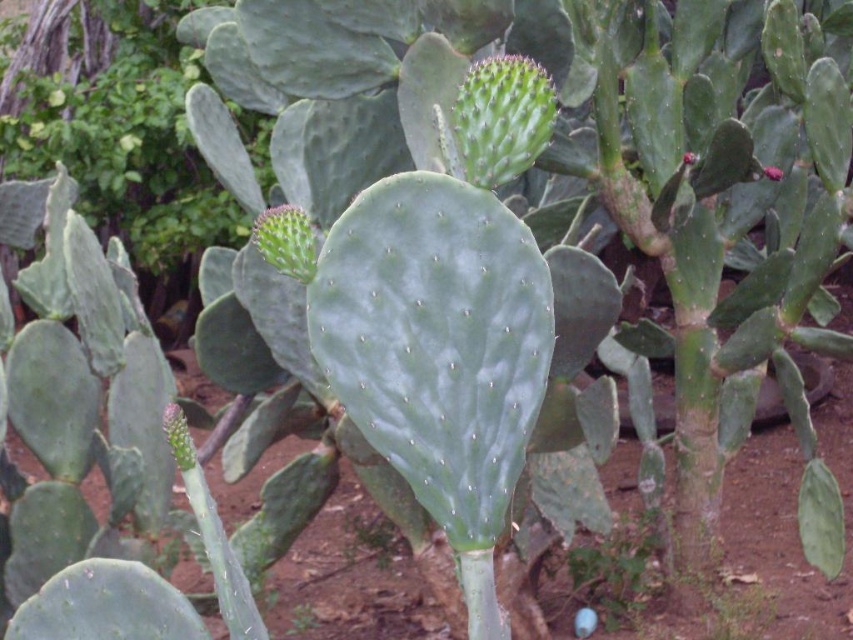
You are a botanist examining two flowers on a prickly pear cactus. You notice a matte pink flower at center and a smooth red flower at upper right. Which flower is larger?

The matte pink flower at center is bigger than the smooth red flower at upper right.

You are a botanist examining a prickly pear cactus. You notice a point labeled as point [772,172]. What is the significance of this point?

The point [772,172] corresponds to the location of the matte pink flower at center.

You are a botanist measuring the distance between two flowers on a cactus. You have a ruler that can extend up to 10 inches. Can you measure the distance between the matte pink flower at center and the smooth red flower at upper right without the ruler extending beyond its maximum limit?

The matte pink flower at center is 9.62 inches away from the smooth red flower at upper right, so yes, the ruler can measure the distance since 9.62 inches is within the ruler maximum limit of 10 inches.